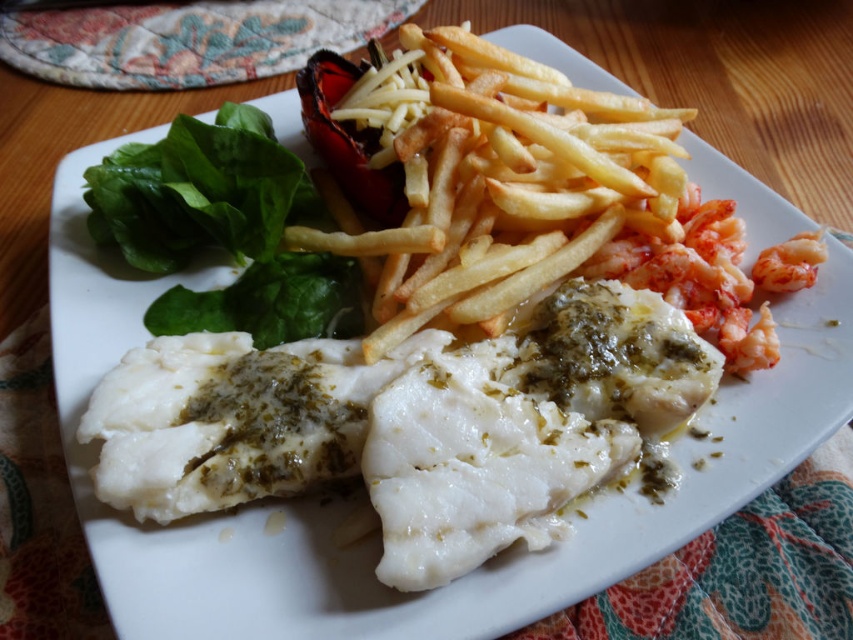
Question: Among these points, which one is nearest to the camera?

Choices:
 (A) (645, 234)
 (B) (811, 234)

Answer: (B)

Question: Which object is positioned farthest from the shiny pink shrimp at right?

Choices:
 (A) green leafy vegetable at upper left
 (B) translucent pink shrimp at upper right

Answer: (A)

Question: Which object is farther from the camera taking this photo?

Choices:
 (A) green leafy vegetable at upper left
 (B) shiny pink shrimp at right
 (C) translucent pink shrimp at upper right

Answer: (A)

Question: Is green leafy vegetable at upper left wider than translucent pink shrimp at upper right?

Choices:
 (A) yes
 (B) no

Answer: (A)

Question: Does shiny pink shrimp at right come in front of translucent pink shrimp at upper right?

Choices:
 (A) yes
 (B) no

Answer: (A)

Question: Does green leafy vegetable at upper left lie behind translucent pink shrimp at upper right?

Choices:
 (A) no
 (B) yes

Answer: (B)